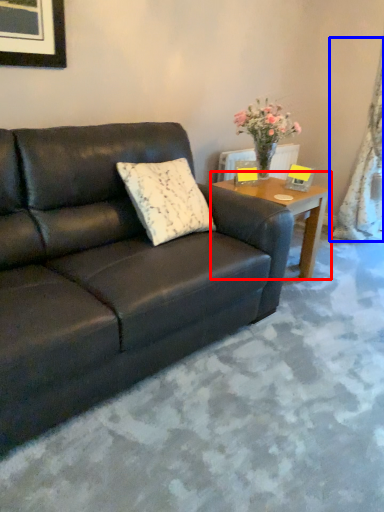
Question: Which point is closer to the camera, coffee table (highlighted by a red box) or curtain (highlighted by a blue box)?

Choices:
 (A) coffee table
 (B) curtain

Answer: (A)